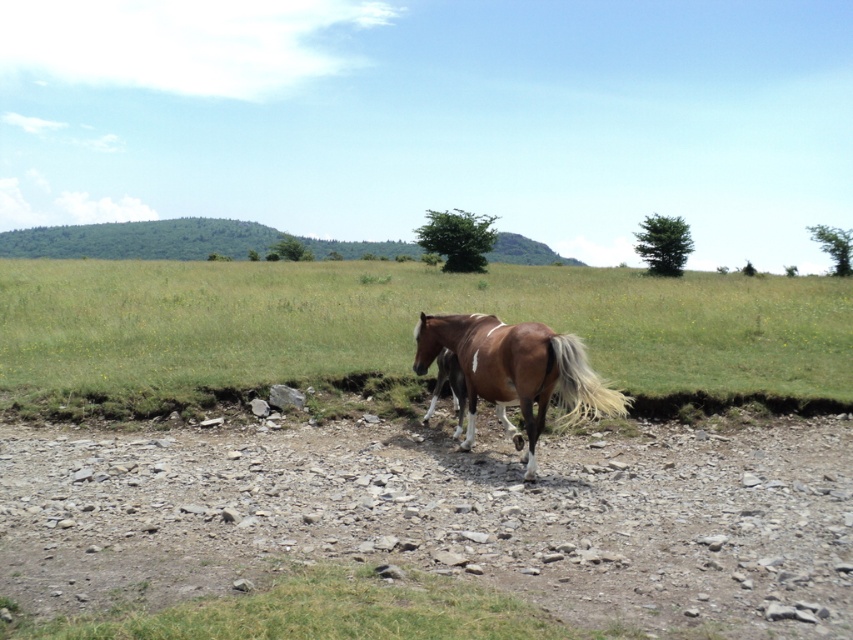
You are a gardener who needs to plant a new tree between the brown grass at center and another object. The minimum distance required for planting is 30 feet. Is the distance sufficient?

The distance between the brown grass at center and the other object is 33.26 feet, which is more than the required 30 feet, so the planting is possible.

You are a photographer trying to capture the brown glossy horse at center and the brown grass at center in a single shot. Based on their positions, which one will appear closer to the camera in the photo?

The brown grass at center is located above the brown glossy horse at center, so in the photo, the brown grass at center will appear closer to the camera because objects higher in the frame typically give the illusion of being nearer to the viewer.

You are a hiker standing at the start of the brown gravel dirt track at center and want to reach the brown glossy horse at center. Which direction should you move to get closer to the horse?

The brown gravel dirt track at center is located below the brown glossy horse at center, so you should move upward along the track to reach the horse.